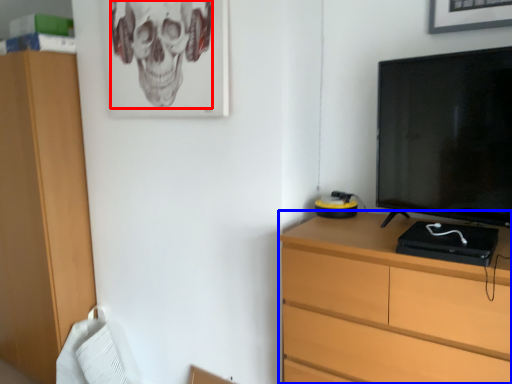
Question: Which object is closer to the camera taking this photo, skull (highlighted by a red box) or chest of drawers (highlighted by a blue box)?

Choices:
 (A) skull
 (B) chest of drawers

Answer: (B)